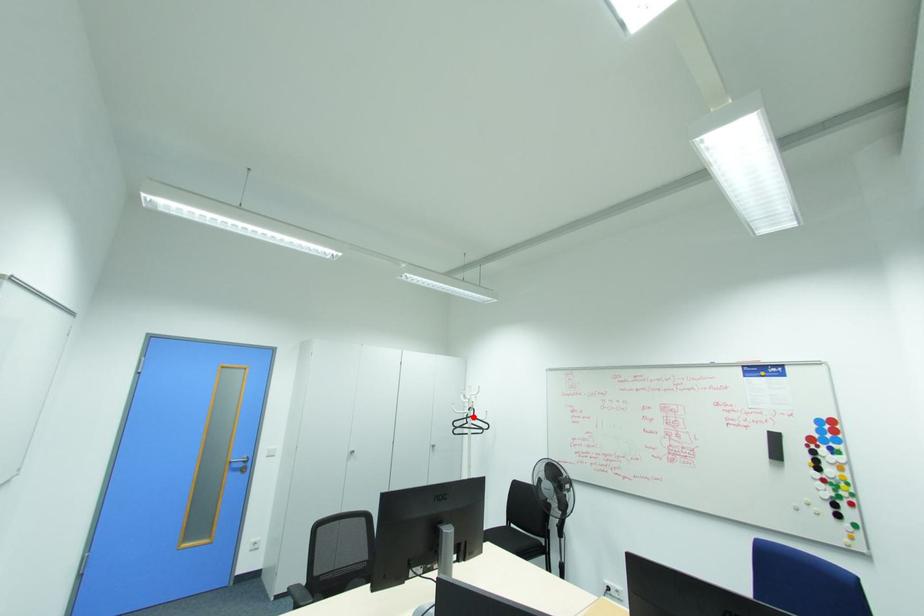
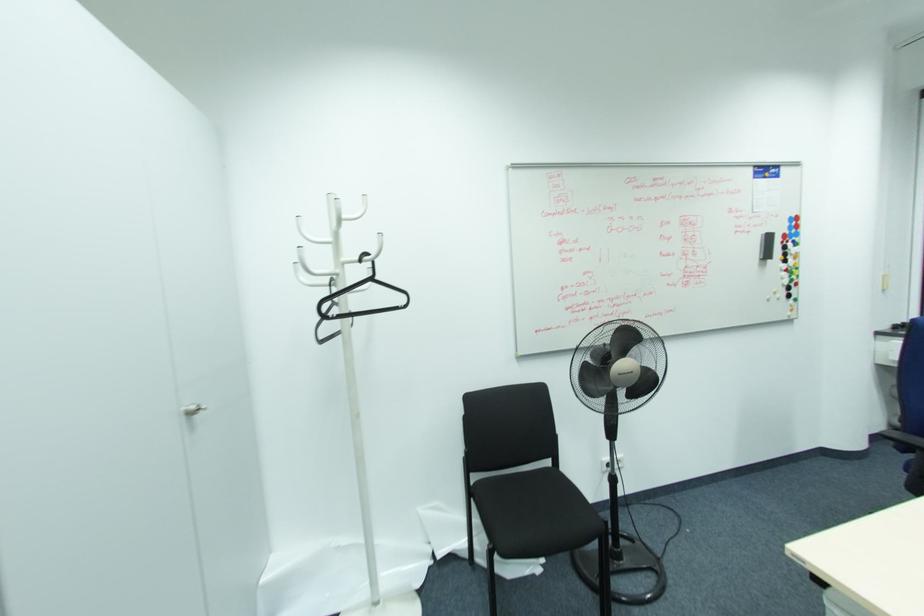
The point at the highlighted location is marked in the first image. Where is the corresponding point in the second image?

(371, 280)